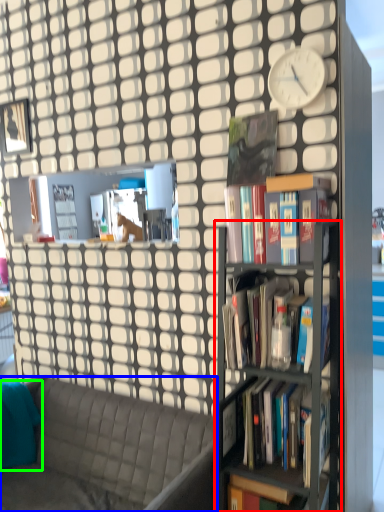
Question: Considering the real-world distances, which object is closest to bookshelf (highlighted by a red box)? studio couch (highlighted by a blue box) or pillow (highlighted by a green box).

Choices:
 (A) studio couch
 (B) pillow

Answer: (A)